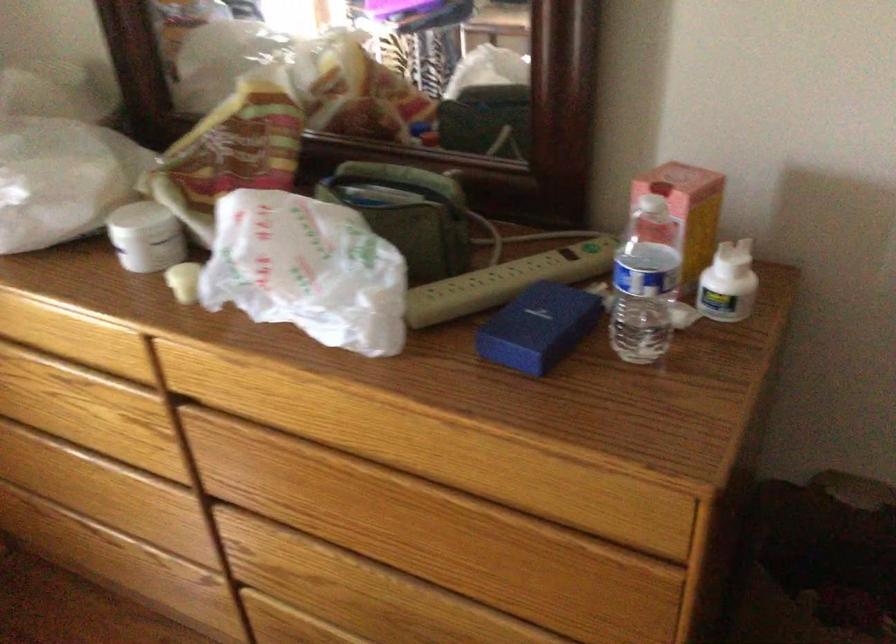
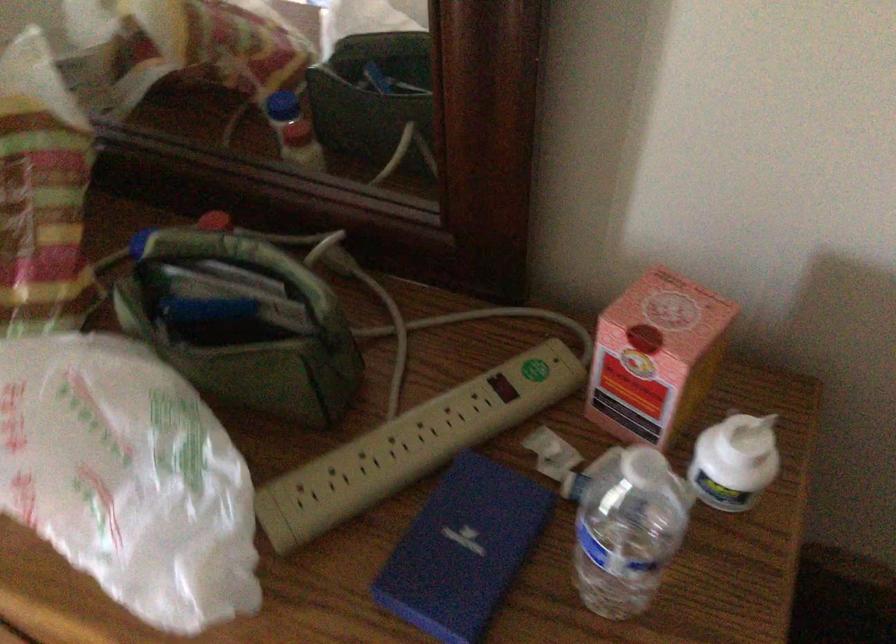
Where in the second image is the point corresponding to pixel 322 270 from the first image?

(126, 478)